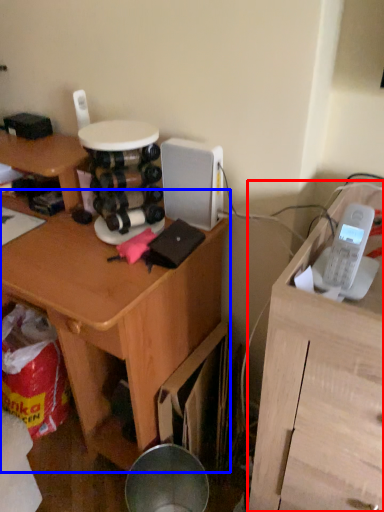
Question: Which point is further to the camera, furniture (highlighted by a red box) or desk (highlighted by a blue box)?

Choices:
 (A) furniture
 (B) desk

Answer: (B)